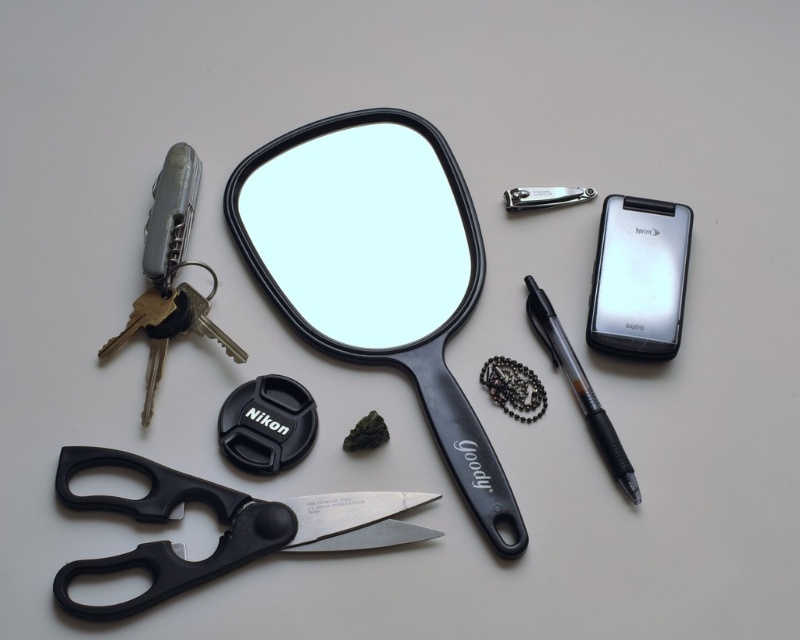
You are standing in front of the scene. A small drone is flying towards the point at coordinates [298,209]. If the drone is 1.2 meters away from you, will it reach the point before it?

The point at coordinates [298,209] is 1.34 meters from the viewer. Since the drone is only 1.2 meters away from you, it hasn not reached the point yet.

You are trying to determine which object is bigger between the black plastic view mirror at center and the sleek silver phone at right. Based on the scene, which one is larger?

The black plastic view mirror at center is larger than the sleek silver phone at right.

You are a delivery person trying to place a small package that requires 12 inches of space between two items. Can you fit it between the black plastic view mirror at center and the black plastic scissors at lower left?

The black plastic view mirror at center is 12.14 inches from the black plastic scissors at lower left, so yes, the package can fit between them since the distance is sufficient.